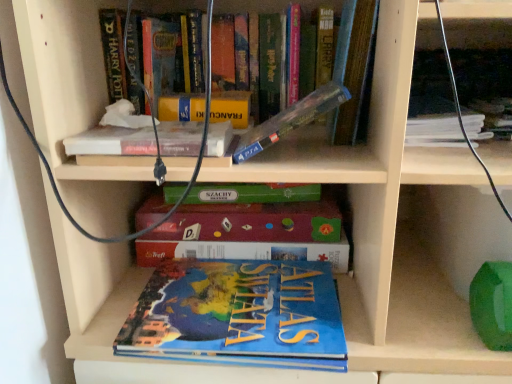
What do you see at coordinates (112, 142) in the screenshot?
I see `white matte book at upper center, the fourth book when ordered from top to bottom` at bounding box center [112, 142].

Find the location of a particular element. The image size is (512, 384). blue matte atlas of the world at lower center, which is the 1th book from bottom to top is located at coordinates (238, 315).

Identify the location of blue cardboard puzzle at center, arranged as the fifth book when viewed from the top. (244, 251).

The height and width of the screenshot is (384, 512). What are the coordinates of `white matte book at upper center, which appears as the 3th book when ordered from the bottom` in the screenshot? It's located at (112, 142).

Between point (367, 75) and point (274, 135), which one is positioned behind?

The point (367, 75) is more distant.

Is hardcover book at upper center, arranged as the first book when viewed from the top, taller than clear plastic case at upper center, the fourth book positioned from the bottom?

Correct, hardcover book at upper center, arranged as the first book when viewed from the top, is much taller as clear plastic case at upper center, the fourth book positioned from the bottom.

From the image's perspective, would you say hardcover book at upper center, arranged as the first book when viewed from the top, is shown under clear plastic case at upper center, the fourth book positioned from the bottom?

No.

Is hardcover book at upper center, positioned as the sixth book in bottom-to-top order, next to clear plastic case at upper center, the fourth book positioned from the bottom, and touching it?

Yes, hardcover book at upper center, positioned as the sixth book in bottom-to-top order, is touching clear plastic case at upper center, the fourth book positioned from the bottom.

Considering the sizes of clear plastic case at upper center, marked as the third book in a top-to-bottom arrangement, and hardcover book at upper center, arranged as the first book when viewed from the top, in the image, is clear plastic case at upper center, marked as the third book in a top-to-bottom arrangement, taller or shorter than hardcover book at upper center, arranged as the first book when viewed from the top,?

Considering their sizes, clear plastic case at upper center, marked as the third book in a top-to-bottom arrangement, has less height than hardcover book at upper center, arranged as the first book when viewed from the top.

Is clear plastic case at upper center, marked as the third book in a top-to-bottom arrangement, smaller than hardcover book at upper center, positioned as the sixth book in bottom-to-top order?

Yes.

From the picture: Would you say clear plastic case at upper center, marked as the third book in a top-to-bottom arrangement, is a long distance from hardcover book at upper center, positioned as the sixth book in bottom-to-top order?

No, there isn't a large distance between clear plastic case at upper center, marked as the third book in a top-to-bottom arrangement, and hardcover book at upper center, positioned as the sixth book in bottom-to-top order.

Is clear plastic case at upper center, the fourth book positioned from the bottom, to the right of hardcover book at upper center, positioned as the sixth book in bottom-to-top order, from the viewer's perspective?

No, clear plastic case at upper center, the fourth book positioned from the bottom, is not to the right of hardcover book at upper center, positioned as the sixth book in bottom-to-top order.

From the picture: In terms of height, does clear plastic case at upper center, the fourth book positioned from the bottom, look taller or shorter compared to hardcover book at upper right, positioned as the fifth book in bottom-to-top order?

Considering their sizes, clear plastic case at upper center, the fourth book positioned from the bottom, has more height than hardcover book at upper right, positioned as the fifth book in bottom-to-top order.

Which is behind, clear plastic case at upper center, the fourth book positioned from the bottom, or hardcover book at upper right, which is the 2th book from top to bottom?

hardcover book at upper right, which is the 2th book from top to bottom, is further from the camera.

Is hardcover book at upper right, positioned as the fifth book in bottom-to-top order, at the back of clear plastic case at upper center, the fourth book positioned from the bottom?

That's not correct — clear plastic case at upper center, the fourth book positioned from the bottom, is not looking away from hardcover book at upper right, positioned as the fifth book in bottom-to-top order.

Consider the image. From the image's perspective, is clear plastic case at upper center, the fourth book positioned from the bottom, located above hardcover book at upper right, which is the 2th book from top to bottom?

No.

From a real-world perspective, is blue cardboard puzzle at center, arranged as the fifth book when viewed from the top, beneath hardcover book at upper right, which is the 2th book from top to bottom?

Yes, from a real-world perspective, blue cardboard puzzle at center, arranged as the fifth book when viewed from the top, is under hardcover book at upper right, which is the 2th book from top to bottom.

From the image's perspective, is blue cardboard puzzle at center, which is the second book in bottom-to-top order, on hardcover book at upper right, which is the 2th book from top to bottom?

No, from the image's perspective, blue cardboard puzzle at center, which is the second book in bottom-to-top order, is not above hardcover book at upper right, which is the 2th book from top to bottom.

Is blue cardboard puzzle at center, which is the second book in bottom-to-top order, located outside hardcover book at upper right, positioned as the fifth book in bottom-to-top order?

Absolutely, blue cardboard puzzle at center, which is the second book in bottom-to-top order, is external to hardcover book at upper right, positioned as the fifth book in bottom-to-top order.

Considering the positions of objects blue cardboard puzzle at center, arranged as the fifth book when viewed from the top, and hardcover book at upper right, which is the 2th book from top to bottom, in the image provided, who is more to the right, blue cardboard puzzle at center, arranged as the fifth book when viewed from the top, or hardcover book at upper right, which is the 2th book from top to bottom,?

Positioned to the right is hardcover book at upper right, which is the 2th book from top to bottom.

What are the coordinates of `the 1st book below the clear plastic case at upper center, the fourth book positioned from the bottom (from the image's perspective)` in the screenshot? It's located at point(112,142).

Is clear plastic case at upper center, the fourth book positioned from the bottom, shorter than white matte book at upper center, which appears as the 3th book when ordered from the bottom?

No.

Considering the positions of objects clear plastic case at upper center, marked as the third book in a top-to-bottom arrangement, and white matte book at upper center, which appears as the 3th book when ordered from the bottom, in the image provided, who is more to the left, clear plastic case at upper center, marked as the third book in a top-to-bottom arrangement, or white matte book at upper center, which appears as the 3th book when ordered from the bottom,?

white matte book at upper center, which appears as the 3th book when ordered from the bottom, is more to the left.

Which object is thinner, clear plastic case at upper center, the fourth book positioned from the bottom, or white matte book at upper center, which appears as the 3th book when ordered from the bottom?

clear plastic case at upper center, the fourth book positioned from the bottom.

Is blue cardboard puzzle at center, which is the second book in bottom-to-top order, positioned with its back to yellow matte book at upper center?

blue cardboard puzzle at center, which is the second book in bottom-to-top order, does not have its back to yellow matte book at upper center.

From the image's perspective, is blue cardboard puzzle at center, which is the second book in bottom-to-top order, located beneath yellow matte book at upper center?

Yes, from the image's perspective, blue cardboard puzzle at center, which is the second book in bottom-to-top order, is beneath yellow matte book at upper center.

Considering the positions of objects blue cardboard puzzle at center, which is the second book in bottom-to-top order, and yellow matte book at upper center in the image provided, who is in front, blue cardboard puzzle at center, which is the second book in bottom-to-top order, or yellow matte book at upper center?

yellow matte book at upper center is more forward.

Is blue cardboard puzzle at center, arranged as the fifth book when viewed from the top, to the left of yellow matte book at upper center from the viewer's perspective?

No, blue cardboard puzzle at center, arranged as the fifth book when viewed from the top, is not to the left of yellow matte book at upper center.

Is hardcover book at upper right, positioned as the fifth book in bottom-to-top order, at the back of white matte book at upper center, the fourth book when ordered from top to bottom?

No.

Which is behind, point (129, 146) or point (492, 110)?

Positioned behind is point (492, 110).

Looking at their sizes, would you say white matte book at upper center, which appears as the 3th book when ordered from the bottom, is wider or thinner than hardcover book at upper right, positioned as the fifth book in bottom-to-top order?

Considering their sizes, white matte book at upper center, which appears as the 3th book when ordered from the bottom, looks broader than hardcover book at upper right, positioned as the fifth book in bottom-to-top order.

In order to click on book above the clear plastic case at upper center, marked as the third book in a top-to-bottom arrangement (from a real-world perspective) in this screenshot , I will do `click(357, 71)`.

This screenshot has width=512, height=384. I want to click on the 1st book counting from the right side of the clear plastic case at upper center, the fourth book positioned from the bottom, so click(x=357, y=71).

Which object lies nearer to the anchor point clear plastic case at upper center, marked as the third book in a top-to-bottom arrangement, yellow matte book at upper center or hardcover book at upper right, positioned as the fifth book in bottom-to-top order?

Based on the image, yellow matte book at upper center appears to be nearer to clear plastic case at upper center, marked as the third book in a top-to-bottom arrangement.

Based on their spatial positions, is hardcover book at upper right, which is the 2th book from top to bottom, or hardcover book at upper center, positioned as the sixth book in bottom-to-top order, further from clear plastic case at upper center, marked as the third book in a top-to-bottom arrangement?

hardcover book at upper right, which is the 2th book from top to bottom, is further to clear plastic case at upper center, marked as the third book in a top-to-bottom arrangement.

Based on their spatial positions, is white matte book at upper center, which appears as the 3th book when ordered from the bottom, or hardcover book at upper right, positioned as the fifth book in bottom-to-top order, closer to blue matte atlas of the world at lower center, which is the 1th book from bottom to top?

Among the two, white matte book at upper center, which appears as the 3th book when ordered from the bottom, is located nearer to blue matte atlas of the world at lower center, which is the 1th book from bottom to top.

From the image, which object appears to be nearer to blue matte atlas of the world at lower center, arranged as the 6th book when viewed from the top, clear plastic case at upper center, marked as the third book in a top-to-bottom arrangement, or blue cardboard puzzle at center, which is the second book in bottom-to-top order?

The object closer to blue matte atlas of the world at lower center, arranged as the 6th book when viewed from the top, is blue cardboard puzzle at center, which is the second book in bottom-to-top order.

From the image, which object appears to be nearer to hardcover book at upper right, positioned as the fifth book in bottom-to-top order, clear plastic case at upper center, the fourth book positioned from the bottom, or white matte book at upper center, which appears as the 3th book when ordered from the bottom?

The object closer to hardcover book at upper right, positioned as the fifth book in bottom-to-top order, is clear plastic case at upper center, the fourth book positioned from the bottom.

Estimate the real-world distances between objects in this image. Which object is closer to blue matte atlas of the world at lower center, which is the 1th book from bottom to top, hardcover book at upper right, which is the 2th book from top to bottom, or yellow matte book at upper center?

yellow matte book at upper center.

Looking at the image, which one is located further to blue cardboard puzzle at center, arranged as the fifth book when viewed from the top, hardcover book at upper center, arranged as the first book when viewed from the top, or yellow matte book at upper center?

hardcover book at upper center, arranged as the first book when viewed from the top, is positioned further to the anchor blue cardboard puzzle at center, arranged as the fifth book when viewed from the top.

Considering their positions, is yellow matte book at upper center positioned further to blue cardboard puzzle at center, which is the second book in bottom-to-top order, than white matte book at upper center, the fourth book when ordered from top to bottom?

white matte book at upper center, the fourth book when ordered from top to bottom, is further to blue cardboard puzzle at center, which is the second book in bottom-to-top order.

Where is `paperback book between hardcover book at upper center, positioned as the sixth book in bottom-to-top order, and blue matte atlas of the world at lower center, arranged as the 6th book when viewed from the top, vertically`? Image resolution: width=512 pixels, height=384 pixels. paperback book between hardcover book at upper center, positioned as the sixth book in bottom-to-top order, and blue matte atlas of the world at lower center, arranged as the 6th book when viewed from the top, vertically is located at coordinates (231, 108).

Image resolution: width=512 pixels, height=384 pixels. Find the location of `book between clear plastic case at upper center, the fourth book positioned from the bottom, and hardcover book at upper right, which is the 2th book from top to bottom, in the horizontal direction`. book between clear plastic case at upper center, the fourth book positioned from the bottom, and hardcover book at upper right, which is the 2th book from top to bottom, in the horizontal direction is located at coordinates (357, 71).

Identify the location of paperback book located between white matte book at upper center, which appears as the 3th book when ordered from the bottom, and hardcover book at upper center, positioned as the sixth book in bottom-to-top order, in the left-right direction. The image size is (512, 384). (231, 108).

Locate an element on the screen. paperback book situated between white matte book at upper center, which appears as the 3th book when ordered from the bottom, and hardcover book at upper right, positioned as the fifth book in bottom-to-top order, from left to right is located at coordinates (231, 108).